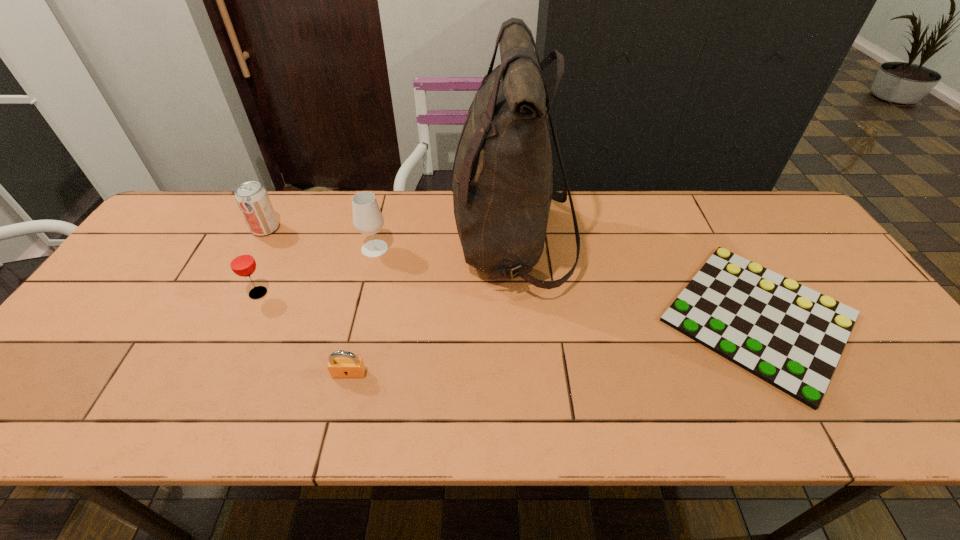
This screenshot has width=960, height=540. I want to click on soda can located in the far edge section of the desktop, so click(252, 198).

Identify the location of object that is at the near edge. (790, 336).

Identify the location of object that is at the right edge. The image size is (960, 540). (790, 336).

Identify the location of object that is at the near right corner. (790, 336).

This screenshot has height=540, width=960. In the image, there is a desktop. Find the location of `free space at the far edge`. free space at the far edge is located at coordinates (549, 228).

In order to click on vacant space at the near edge of the desktop in this screenshot , I will do `click(520, 409)`.

Locate an element on the screen. This screenshot has height=540, width=960. vacant space at the left edge of the desktop is located at coordinates pyautogui.click(x=166, y=265).

This screenshot has width=960, height=540. In the image, there is a desktop. Find the location of `vacant space at the right edge`. vacant space at the right edge is located at coordinates (870, 386).

Locate an element on the screen. empty space between the fifth tallest object and the tallest object is located at coordinates (430, 308).

Find the location of a particular element. This screenshot has width=960, height=540. vacant region between the second shortest object and the farther glass is located at coordinates (362, 311).